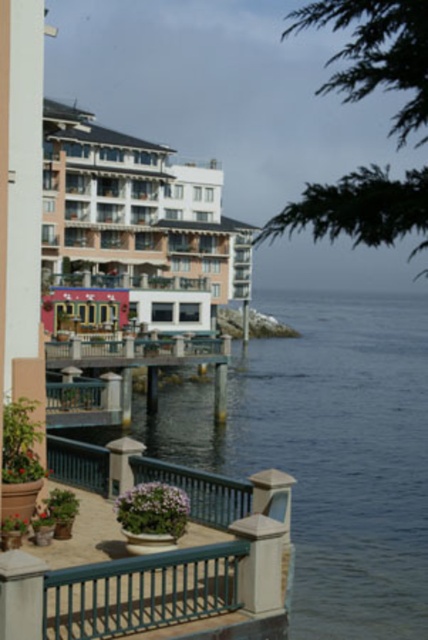
Which is behind, point (68, 232) or point (180, 360)?

Positioned behind is point (68, 232).

Between beige stucco hotel at center and wooden dock at lower left, which one has more height?

Standing taller between the two is beige stucco hotel at center.

Does point (199, 204) come farther from viewer compared to point (118, 340)?

Yes.

This screenshot has width=428, height=640. I want to click on beige stucco hotel at center, so click(x=136, y=212).

Which of these two, beige stucco hotel at center or teal painted wood balcony at lower center, stands shorter?

With less height is teal painted wood balcony at lower center.

Does point (89, 228) come behind point (255, 611)?

Yes, point (89, 228) is behind point (255, 611).

Identify the location of beige stucco hotel at center. The image size is (428, 640). [136, 212].

Identify the location of teal painted wood balcony at lower center. (160, 586).

Can you confirm if teal painted wood balcony at lower center is shorter than wooden dock at lower left?

Correct, teal painted wood balcony at lower center is not as tall as wooden dock at lower left.

Who is more distant from viewer, [148,557] or [76,356]?

Point [76,356]

Where is `teal painted wood balcony at lower center`? The height and width of the screenshot is (640, 428). teal painted wood balcony at lower center is located at coordinates (160, 586).